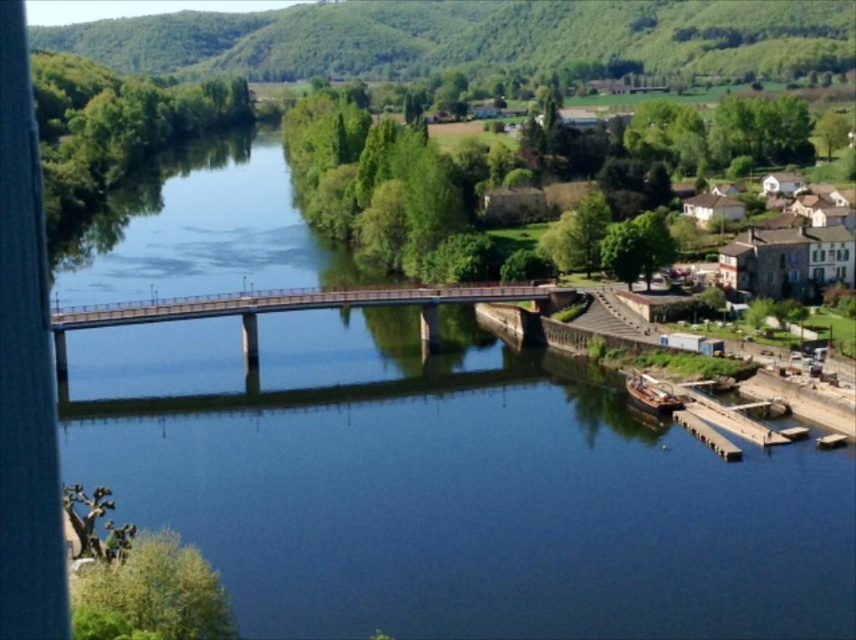
Consider the image. You are a delivery drone with a maximum flight range of 50 meters. You need to deliver a package from the smooth concrete bridge at center to the white stone houses at upper right. Can you complete the delivery without needing a recharge?

The distance between the smooth concrete bridge at center and the white stone houses at upper right is 48.36 meters, which is within your 50 meter range. Yes, you can complete the delivery without needing a recharge.

You are planning to take a photo of the smooth concrete bridge at center and the white stone houses at upper right. Which object should you focus on first if you want to capture both in the same frame without moving the camera?

You should focus on the smooth concrete bridge at center first because it is closer to the camera than the white stone houses at upper right, which are further away. This way, both objects will be in focus within the same frame.

You are a tourist standing on the riverside and want to take a photo that includes both the smooth concrete bridge at center and the white stone houses at upper right. Based on their sizes in the image, which object should you position closer to the center of your camera frame to ensure both are visible?

Since the smooth concrete bridge at center is smaller in size compared to the white stone houses at upper right, you should position the smooth concrete bridge at center closer to the center of your camera frame to ensure both are visible.